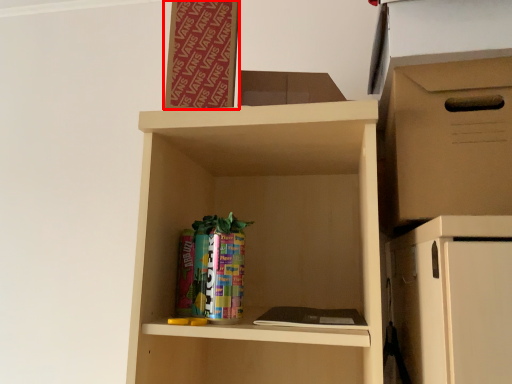
Question: Where is bulletin board (annotated by the red box) located in relation to storage box in the image?

Choices:
 (A) left
 (B) right

Answer: (A)